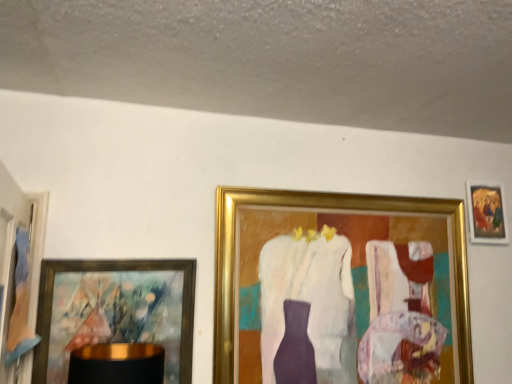
Where is `gold-framed painting at upper right, placed as the first picture frame when sorted from right to left`? Image resolution: width=512 pixels, height=384 pixels. gold-framed painting at upper right, placed as the first picture frame when sorted from right to left is located at coordinates (487, 214).

The height and width of the screenshot is (384, 512). Describe the element at coordinates (487, 214) in the screenshot. I see `gold-framed painting at upper right, placed as the first picture frame when sorted from right to left` at that location.

This screenshot has height=384, width=512. Describe the element at coordinates (327, 209) in the screenshot. I see `gold metallic picture frame at center, marked as the third picture frame in a left-to-right arrangement` at that location.

Image resolution: width=512 pixels, height=384 pixels. What do you see at coordinates (115, 311) in the screenshot? I see `gold-framed painting at left, positioned as the second picture frame in left-to-right order` at bounding box center [115, 311].

You are a GUI agent. You are given a task and a screenshot of the screen. Output one action in this format:
    pyautogui.click(x=<x>, y=<y>)
    Task: Click on the gold-framed painting at upper right, which appears as the 4th picture frame when viewed from the left
    The height and width of the screenshot is (384, 512).
    Given the screenshot: What is the action you would take?
    [x=487, y=214]

Considering the relative positions of wooden picture frame at left, positioned as the first picture frame in left-to-right order, and gold metallic picture frame at center, the second picture frame viewed from the right, in the image provided, is wooden picture frame at left, positioned as the first picture frame in left-to-right order, to the left of gold metallic picture frame at center, the second picture frame viewed from the right, from the viewer's perspective?

Correct, you'll find wooden picture frame at left, positioned as the first picture frame in left-to-right order, to the left of gold metallic picture frame at center, the second picture frame viewed from the right.

Consider the image. Is wooden picture frame at left, which is the 4th picture frame in right-to-left order, with gold metallic picture frame at center, marked as the third picture frame in a left-to-right arrangement?

They are not placed beside each other.

Is wooden picture frame at left, positioned as the first picture frame in left-to-right order, outside of gold metallic picture frame at center, marked as the third picture frame in a left-to-right arrangement?

Yes, wooden picture frame at left, positioned as the first picture frame in left-to-right order, is located beyond the bounds of gold metallic picture frame at center, marked as the third picture frame in a left-to-right arrangement.

Considering the positions of objects wooden picture frame at left, which is the 4th picture frame in right-to-left order, and gold metallic picture frame at center, marked as the third picture frame in a left-to-right arrangement, in the image provided, who is in front, wooden picture frame at left, which is the 4th picture frame in right-to-left order, or gold metallic picture frame at center, marked as the third picture frame in a left-to-right arrangement,?

Positioned in front is wooden picture frame at left, which is the 4th picture frame in right-to-left order.

Between gold-framed painting at upper right, which appears as the 4th picture frame when viewed from the left, and wooden picture frame at left, positioned as the first picture frame in left-to-right order, which one appears on the left side from the viewer's perspective?

wooden picture frame at left, positioned as the first picture frame in left-to-right order.

Between gold-framed painting at upper right, placed as the first picture frame when sorted from right to left, and wooden picture frame at left, which is the 4th picture frame in right-to-left order, which one has larger width?

Wider between the two is wooden picture frame at left, which is the 4th picture frame in right-to-left order.

Is gold-framed painting at upper right, placed as the first picture frame when sorted from right to left, completely or partially outside of gold metallic picture frame at center, the second picture frame viewed from the right?

Absolutely, gold-framed painting at upper right, placed as the first picture frame when sorted from right to left, is external to gold metallic picture frame at center, the second picture frame viewed from the right.

Between gold-framed painting at upper right, which appears as the 4th picture frame when viewed from the left, and gold metallic picture frame at center, marked as the third picture frame in a left-to-right arrangement, which one appears on the right side from the viewer's perspective?

gold-framed painting at upper right, which appears as the 4th picture frame when viewed from the left.

From a real-world perspective, is gold-framed painting at upper right, placed as the first picture frame when sorted from right to left, positioned above or below gold metallic picture frame at center, the second picture frame viewed from the right?

gold-framed painting at upper right, placed as the first picture frame when sorted from right to left, is situated higher than gold metallic picture frame at center, the second picture frame viewed from the right, in the real world.

Based on the photo, considering the relative sizes of gold-framed painting at upper right, which appears as the 4th picture frame when viewed from the left, and gold metallic picture frame at center, marked as the third picture frame in a left-to-right arrangement, in the image provided, is gold-framed painting at upper right, which appears as the 4th picture frame when viewed from the left, shorter than gold metallic picture frame at center, marked as the third picture frame in a left-to-right arrangement,?

Yes, gold-framed painting at upper right, which appears as the 4th picture frame when viewed from the left, is shorter than gold metallic picture frame at center, marked as the third picture frame in a left-to-right arrangement.

Which object is closer to the camera, wooden picture frame at left, positioned as the first picture frame in left-to-right order, or gold-framed painting at upper right, which appears as the 4th picture frame when viewed from the left?

wooden picture frame at left, positioned as the first picture frame in left-to-right order, is in front.

From the image's perspective, which object appears higher, wooden picture frame at left, positioned as the first picture frame in left-to-right order, or gold-framed painting at upper right, placed as the first picture frame when sorted from right to left?

gold-framed painting at upper right, placed as the first picture frame when sorted from right to left, is shown above in the image.

Considering the relative positions of wooden picture frame at left, positioned as the first picture frame in left-to-right order, and gold-framed painting at upper right, which appears as the 4th picture frame when viewed from the left, in the image provided, is wooden picture frame at left, positioned as the first picture frame in left-to-right order, to the left or to the right of gold-framed painting at upper right, which appears as the 4th picture frame when viewed from the left,?

Based on their positions, wooden picture frame at left, positioned as the first picture frame in left-to-right order, is located to the left of gold-framed painting at upper right, which appears as the 4th picture frame when viewed from the left.

From a real-world perspective, is wooden picture frame at left, positioned as the first picture frame in left-to-right order, positioned under gold-framed painting at upper right, which appears as the 4th picture frame when viewed from the left, based on gravity?

Yes, from a real-world perspective, wooden picture frame at left, positioned as the first picture frame in left-to-right order, is beneath gold-framed painting at upper right, which appears as the 4th picture frame when viewed from the left.

Considering the sizes of objects wooden picture frame at left, which is the 4th picture frame in right-to-left order, and gold-framed painting at left, which ranks as the third picture frame in right-to-left order, in the image provided, who is bigger, wooden picture frame at left, which is the 4th picture frame in right-to-left order, or gold-framed painting at left, which ranks as the third picture frame in right-to-left order,?

With larger size is wooden picture frame at left, which is the 4th picture frame in right-to-left order.

From a real-world perspective, between wooden picture frame at left, which is the 4th picture frame in right-to-left order, and gold-framed painting at left, which ranks as the third picture frame in right-to-left order, who is vertically lower?

gold-framed painting at left, which ranks as the third picture frame in right-to-left order.

Where is `the 1st picture frame to the right when counting from the wooden picture frame at left, positioned as the first picture frame in left-to-right order`? the 1st picture frame to the right when counting from the wooden picture frame at left, positioned as the first picture frame in left-to-right order is located at coordinates (115, 311).

Consider the image. Are gold-framed painting at left, which ranks as the third picture frame in right-to-left order, and wooden picture frame at left, positioned as the first picture frame in left-to-right order, beside each other?

No, gold-framed painting at left, which ranks as the third picture frame in right-to-left order, is not touching wooden picture frame at left, positioned as the first picture frame in left-to-right order.

What's the angular difference between gold-framed painting at left, which ranks as the third picture frame in right-to-left order, and wooden picture frame at left, which is the 4th picture frame in right-to-left order,'s facing directions?

They differ by 85.4 degrees in their facing directions.

Could you tell me if gold-framed painting at left, which ranks as the third picture frame in right-to-left order, is facing wooden picture frame at left, positioned as the first picture frame in left-to-right order?

Yes, gold-framed painting at left, which ranks as the third picture frame in right-to-left order, is facing wooden picture frame at left, positioned as the first picture frame in left-to-right order.

Measure the distance from gold-framed painting at left, positioned as the second picture frame in left-to-right order, to wooden picture frame at left, positioned as the first picture frame in left-to-right order.

gold-framed painting at left, positioned as the second picture frame in left-to-right order, is 10.21 inches from wooden picture frame at left, positioned as the first picture frame in left-to-right order.

Is gold-framed painting at left, positioned as the second picture frame in left-to-right order, not near gold metallic picture frame at center, the second picture frame viewed from the right?

gold-framed painting at left, positioned as the second picture frame in left-to-right order, is actually quite close to gold metallic picture frame at center, the second picture frame viewed from the right.

From the image's perspective, relative to gold metallic picture frame at center, marked as the third picture frame in a left-to-right arrangement, is gold-framed painting at left, which ranks as the third picture frame in right-to-left order, above or below?

Clearly, from the image's perspective, gold-framed painting at left, which ranks as the third picture frame in right-to-left order, is below gold metallic picture frame at center, marked as the third picture frame in a left-to-right arrangement.

Is gold-framed painting at left, positioned as the second picture frame in left-to-right order, behind gold metallic picture frame at center, marked as the third picture frame in a left-to-right arrangement?

No, gold-framed painting at left, positioned as the second picture frame in left-to-right order, is closer to the camera.

Image resolution: width=512 pixels, height=384 pixels. There is a gold metallic picture frame at center, marked as the third picture frame in a left-to-right arrangement. What are the coordinates of `the 1st picture frame above it (from the image's perspective)` in the screenshot? It's located at (27, 280).

Starting from the gold-framed painting at upper right, which appears as the 4th picture frame when viewed from the left, which picture frame is the 3rd one in front? Please provide its 2D coordinates.

[(27, 280)]

Estimate the real-world distances between objects in this image. Which object is further from gold-framed painting at left, which ranks as the third picture frame in right-to-left order, gold-framed painting at upper right, placed as the first picture frame when sorted from right to left, or wooden picture frame at left, which is the 4th picture frame in right-to-left order?

gold-framed painting at upper right, placed as the first picture frame when sorted from right to left, lies further to gold-framed painting at left, which ranks as the third picture frame in right-to-left order, than the other object.

Which object lies nearer to the anchor point gold metallic picture frame at center, marked as the third picture frame in a left-to-right arrangement, gold-framed painting at left, positioned as the second picture frame in left-to-right order, or gold-framed painting at upper right, placed as the first picture frame when sorted from right to left?

gold-framed painting at upper right, placed as the first picture frame when sorted from right to left, is closer to gold metallic picture frame at center, marked as the third picture frame in a left-to-right arrangement.

When comparing their distances from gold-framed painting at upper right, placed as the first picture frame when sorted from right to left, does wooden picture frame at left, which is the 4th picture frame in right-to-left order, or gold metallic picture frame at center, marked as the third picture frame in a left-to-right arrangement, seem closer?

gold metallic picture frame at center, marked as the third picture frame in a left-to-right arrangement, lies closer to gold-framed painting at upper right, placed as the first picture frame when sorted from right to left, than the other object.

Looking at the image, which one is located further to gold-framed painting at left, which ranks as the third picture frame in right-to-left order, gold metallic picture frame at center, the second picture frame viewed from the right, or gold-framed painting at upper right, placed as the first picture frame when sorted from right to left?

Among the two, gold-framed painting at upper right, placed as the first picture frame when sorted from right to left, is located further to gold-framed painting at left, which ranks as the third picture frame in right-to-left order.

When comparing their distances from gold-framed painting at upper right, placed as the first picture frame when sorted from right to left, does gold metallic picture frame at center, the second picture frame viewed from the right, or wooden picture frame at left, positioned as the first picture frame in left-to-right order, seem closer?

gold metallic picture frame at center, the second picture frame viewed from the right.

Looking at the image, which one is located further to gold metallic picture frame at center, marked as the third picture frame in a left-to-right arrangement, wooden picture frame at left, which is the 4th picture frame in right-to-left order, or gold-framed painting at upper right, placed as the first picture frame when sorted from right to left?

wooden picture frame at left, which is the 4th picture frame in right-to-left order, lies further to gold metallic picture frame at center, marked as the third picture frame in a left-to-right arrangement, than the other object.

When comparing their distances from gold-framed painting at upper right, placed as the first picture frame when sorted from right to left, does gold metallic picture frame at center, marked as the third picture frame in a left-to-right arrangement, or gold-framed painting at left, which ranks as the third picture frame in right-to-left order, seem closer?

The object closer to gold-framed painting at upper right, placed as the first picture frame when sorted from right to left, is gold metallic picture frame at center, marked as the third picture frame in a left-to-right arrangement.

From the picture: From the image, which object appears to be farther from wooden picture frame at left, which is the 4th picture frame in right-to-left order, gold-framed painting at left, positioned as the second picture frame in left-to-right order, or gold-framed painting at upper right, placed as the first picture frame when sorted from right to left?

The object further to wooden picture frame at left, which is the 4th picture frame in right-to-left order, is gold-framed painting at upper right, placed as the first picture frame when sorted from right to left.

Where is `picture frame between wooden picture frame at left, positioned as the first picture frame in left-to-right order, and gold metallic picture frame at center, the second picture frame viewed from the right, in the horizontal direction`? This screenshot has height=384, width=512. picture frame between wooden picture frame at left, positioned as the first picture frame in left-to-right order, and gold metallic picture frame at center, the second picture frame viewed from the right, in the horizontal direction is located at coordinates (115, 311).

The height and width of the screenshot is (384, 512). Identify the location of picture frame between gold-framed painting at left, which ranks as the third picture frame in right-to-left order, and gold-framed painting at upper right, placed as the first picture frame when sorted from right to left, in the horizontal direction. (327, 209).